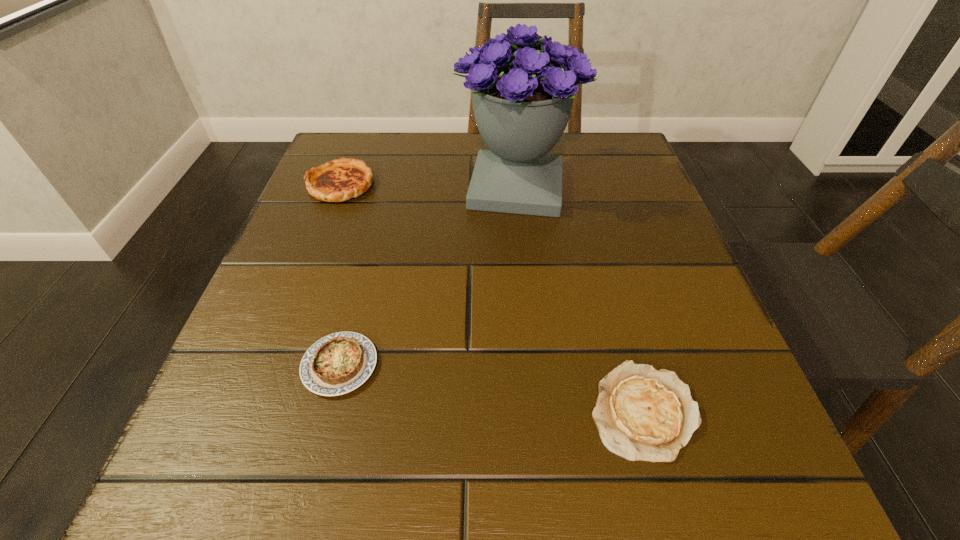
What are the coordinates of `the tallest object` in the screenshot? It's located at (522, 103).

Image resolution: width=960 pixels, height=540 pixels. Identify the location of the farthest quiche. (339, 180).

You are a GUI agent. You are given a task and a screenshot of the screen. Output one action in this format:
    pyautogui.click(x=<x>, y=<y>)
    Task: Click on the tallest quiche
    The image size is (960, 540).
    Given the screenshot: What is the action you would take?
    pyautogui.click(x=339, y=180)

At what (x,y) coordinates should I click in order to perform the action: click on the rightmost quiche. Please return your answer as a coordinate pair (x, y). Looking at the image, I should click on (641, 413).

Locate an element on the screen. This screenshot has height=540, width=960. free location located on the left of the bouquet is located at coordinates (339, 187).

Find the location of a particular element. free space located 0.350m on the front of the tallest quiche is located at coordinates (276, 357).

Where is `vacant area situated 0.060m on the back of the rightmost quiche`? This screenshot has width=960, height=540. vacant area situated 0.060m on the back of the rightmost quiche is located at coordinates (620, 329).

Locate an element on the screen. The image size is (960, 540). bouquet located in the far edge section of the desktop is located at coordinates (522, 103).

Find the location of `quiche that is at the far edge`. quiche that is at the far edge is located at coordinates (339, 180).

Locate an element on the screen. object located at the near edge is located at coordinates (641, 413).